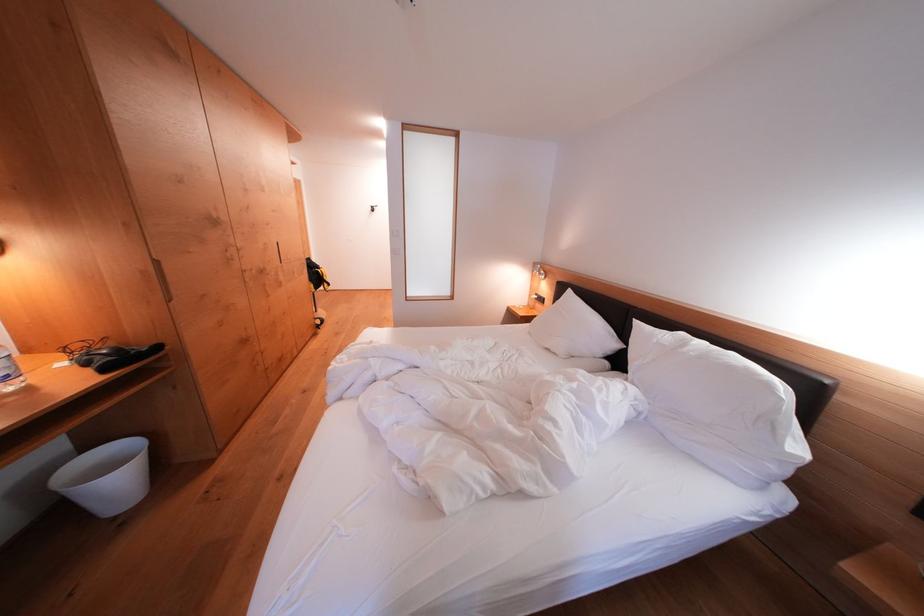
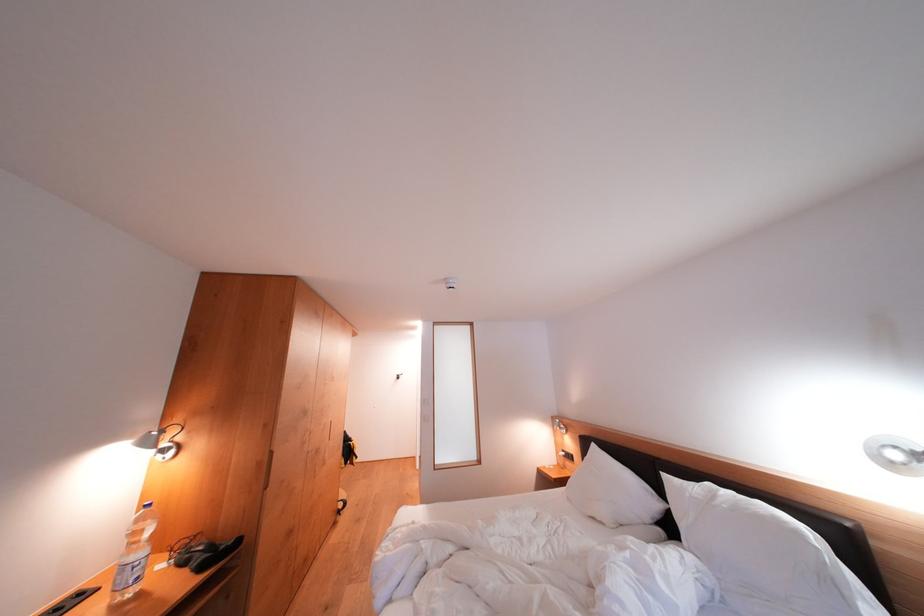
The point at (x=92, y=368) is marked in the first image. Where is the corresponding point in the second image?

(190, 567)